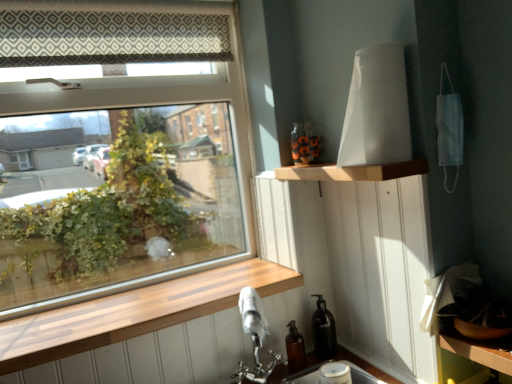
Question: Is wooden at lower left at the back of wooden shelf at upper center?

Choices:
 (A) yes
 (B) no

Answer: (B)

Question: Does wooden shelf at upper center have a smaller size compared to wooden at lower left?

Choices:
 (A) no
 (B) yes

Answer: (B)

Question: From a real-world perspective, is wooden shelf at upper center physically below wooden at lower left?

Choices:
 (A) no
 (B) yes

Answer: (A)

Question: Is wooden shelf at upper center shorter than wooden at lower left?

Choices:
 (A) no
 (B) yes

Answer: (B)

Question: From a real-world perspective, is wooden shelf at upper center located higher than wooden at lower left?

Choices:
 (A) yes
 (B) no

Answer: (A)

Question: Can you confirm if wooden shelf at upper center is thinner than wooden at lower left?

Choices:
 (A) no
 (B) yes

Answer: (B)

Question: From a real-world perspective, is wooden shelf at upper center physically above transparent glass window at upper left?

Choices:
 (A) no
 (B) yes

Answer: (A)

Question: Is wooden shelf at upper center further to the viewer compared to transparent glass window at upper left?

Choices:
 (A) no
 (B) yes

Answer: (A)

Question: Are wooden shelf at upper center and transparent glass window at upper left beside each other?

Choices:
 (A) yes
 (B) no

Answer: (B)

Question: Does wooden shelf at upper center have a greater height compared to transparent glass window at upper left?

Choices:
 (A) no
 (B) yes

Answer: (A)

Question: Could you tell me if wooden shelf at upper center is turned towards transparent glass window at upper left?

Choices:
 (A) no
 (B) yes

Answer: (A)

Question: Is wooden shelf at upper center shorter than transparent glass window at upper left?

Choices:
 (A) yes
 (B) no

Answer: (A)

Question: Would you say transparent glass window at upper left contains wooden shelf at upper center?

Choices:
 (A) no
 (B) yes

Answer: (A)